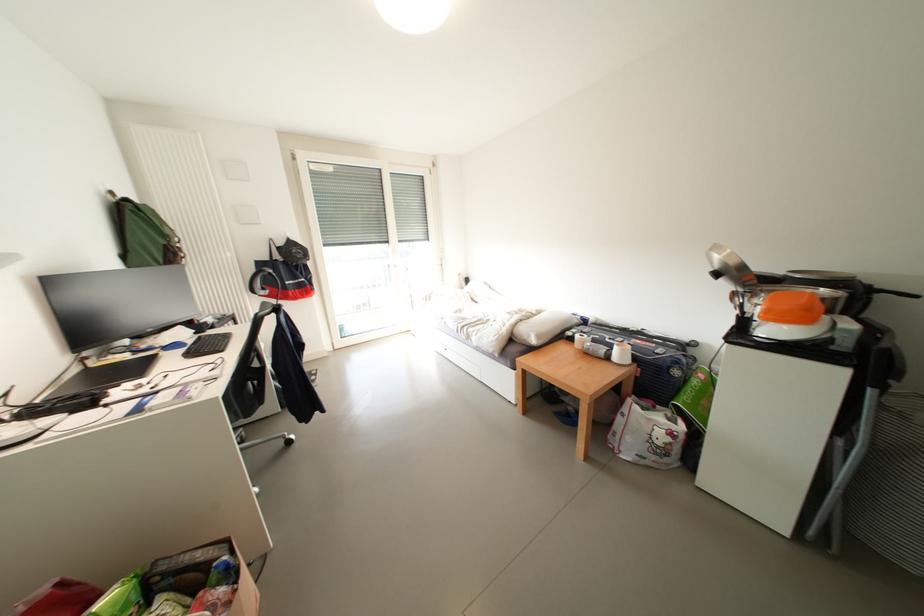
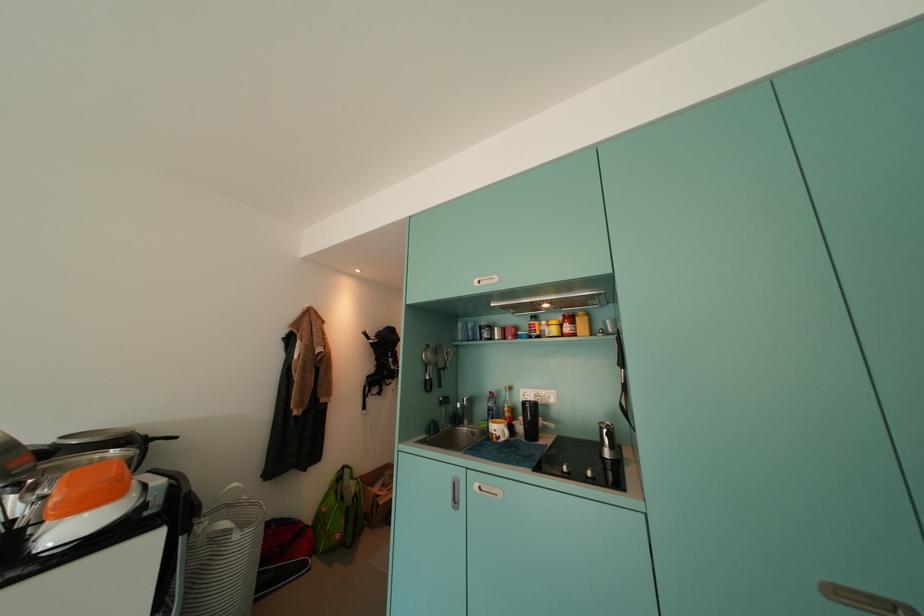
Question: The first image is from the beginning of the video and the second image is from the end. How did the camera likely rotate when shooting the video?

Choices:
 (A) Left
 (B) Right
 (C) Up
 (D) Down

Answer: (B)